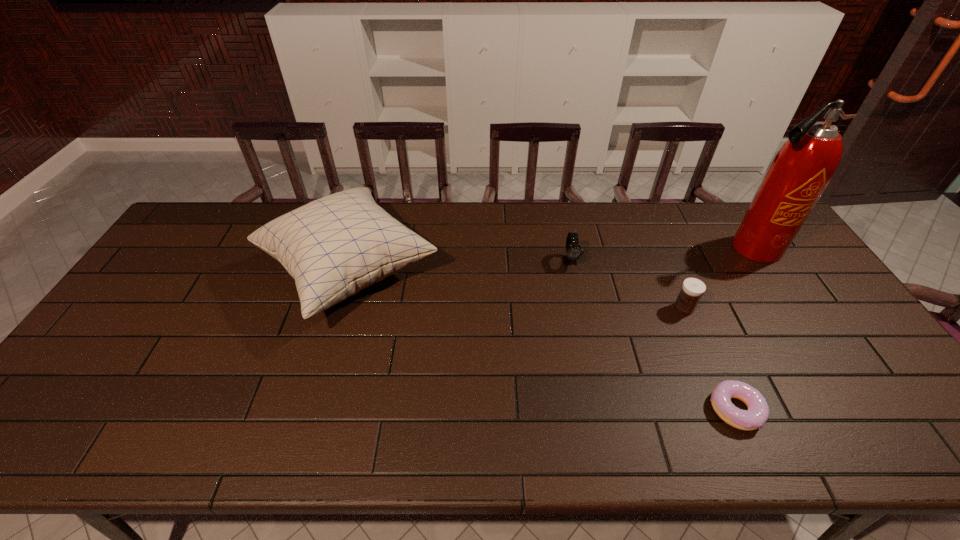
Identify the location of the rightmost object. This screenshot has width=960, height=540. (800, 172).

At what (x,y) coordinates should I click in order to perform the action: click on the tallest object. Please return your answer as a coordinate pair (x, y). The height and width of the screenshot is (540, 960). Looking at the image, I should click on 800,172.

Image resolution: width=960 pixels, height=540 pixels. Identify the location of the second tallest object. (335, 246).

Find the location of `the leftmost object`. the leftmost object is located at coordinates (335, 246).

Where is `the second object from left to right`? the second object from left to right is located at coordinates (573, 249).

At what (x,y) coordinates should I click in order to perform the action: click on medicine. Please return your answer as a coordinate pair (x, y). Looking at the image, I should click on (692, 289).

Locate an element on the screen. The width and height of the screenshot is (960, 540). doughnut is located at coordinates (757, 414).

Where is `the shortest object`? This screenshot has height=540, width=960. the shortest object is located at coordinates (757, 414).

Where is `vacant space located on the back of the tallest object`? vacant space located on the back of the tallest object is located at coordinates (724, 204).

The height and width of the screenshot is (540, 960). What are the coordinates of `free space located 0.070m on the left of the leftmost object` in the screenshot? It's located at (234, 272).